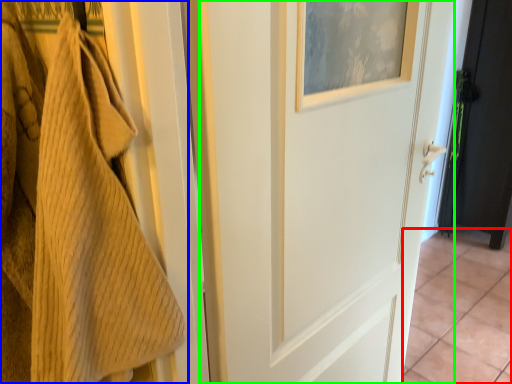
Question: Which object is positioned farthest from tile (highlighted by a red box)? Select from towel (highlighted by a blue box) and door (highlighted by a green box).

Choices:
 (A) towel
 (B) door

Answer: (A)